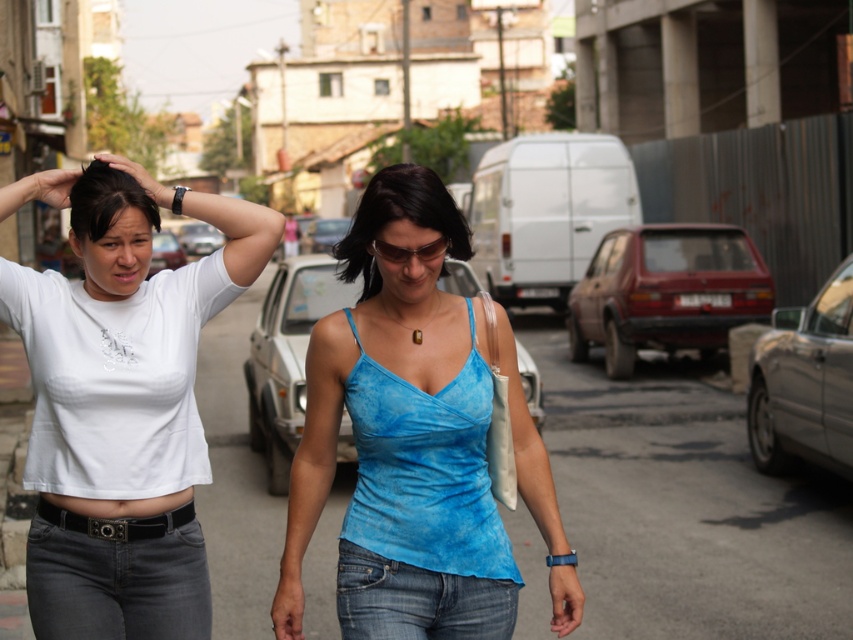
You are a photographer trying to capture the scene. You notice two elements in the upper left corner of your viewfinder. One is dark brown shiny hair at upper left and the other is matte black hand at upper left. Which one is positioned to the right of the other?

The dark brown shiny hair at upper left is positioned to the right of the matte black hand at upper left.

You are a fashion designer analyzing the image. You need to determine which item is narrower between the denim jeans at lower left and the matte black watch at upper center. Which one is thinner?

The denim jeans at lower left is thinner than the matte black watch at upper center according to the description.